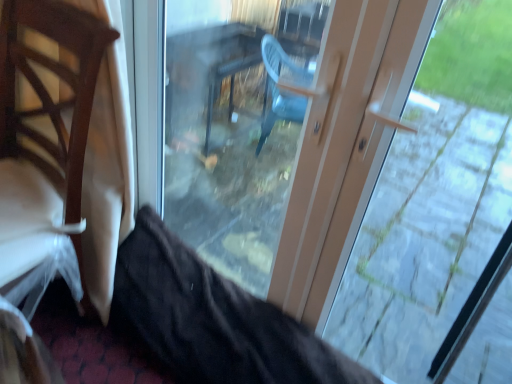
Question: Considering the relative positions of matte plastic door at center and wooden chair at left in the image provided, is matte plastic door at center behind wooden chair at left?

Choices:
 (A) yes
 (B) no

Answer: (B)

Question: Can you confirm if matte plastic door at center is wider than wooden chair at left?

Choices:
 (A) no
 (B) yes

Answer: (A)

Question: Could wooden chair at left be considered to be inside matte plastic door at center?

Choices:
 (A) no
 (B) yes

Answer: (A)

Question: Is matte plastic door at center far from wooden chair at left?

Choices:
 (A) yes
 (B) no

Answer: (A)

Question: From a real-world perspective, is matte plastic door at center on wooden chair at left?

Choices:
 (A) no
 (B) yes

Answer: (B)

Question: Is matte plastic door at center shorter than wooden chair at left?

Choices:
 (A) no
 (B) yes

Answer: (A)

Question: Does matte plastic door at center have a greater height compared to transparent glass door at center?

Choices:
 (A) no
 (B) yes

Answer: (B)

Question: From the image's perspective, is matte plastic door at center on transparent glass door at center?

Choices:
 (A) yes
 (B) no

Answer: (B)

Question: Is matte plastic door at center shorter than transparent glass door at center?

Choices:
 (A) no
 (B) yes

Answer: (A)

Question: Is matte plastic door at center positioned with its back to transparent glass door at center?

Choices:
 (A) no
 (B) yes

Answer: (B)

Question: Would you say matte plastic door at center is outside transparent glass door at center?

Choices:
 (A) yes
 (B) no

Answer: (B)

Question: Is matte plastic door at center smaller than transparent glass door at center?

Choices:
 (A) yes
 (B) no

Answer: (B)

Question: From a real-world perspective, is transparent glass door at center positioned under matte plastic door at center based on gravity?

Choices:
 (A) no
 (B) yes

Answer: (B)